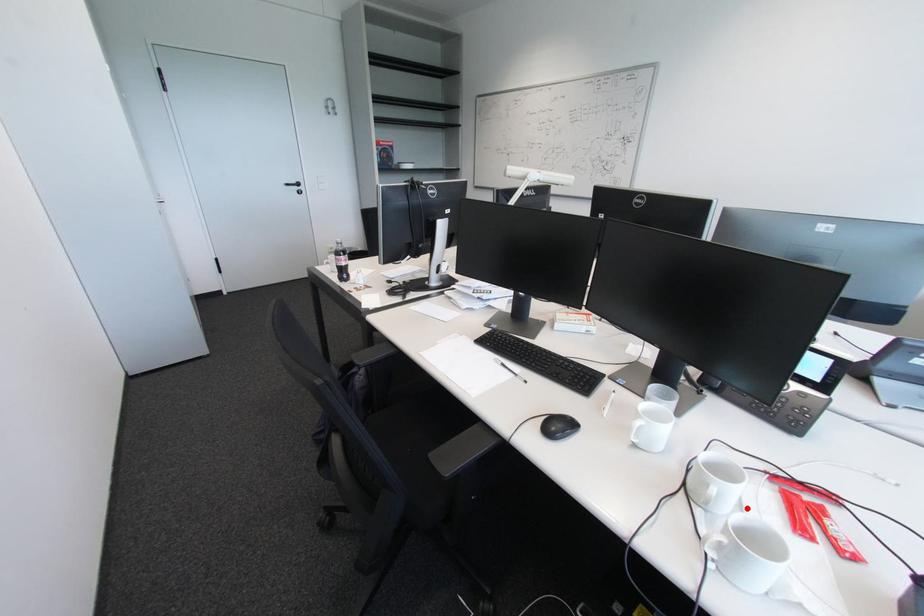
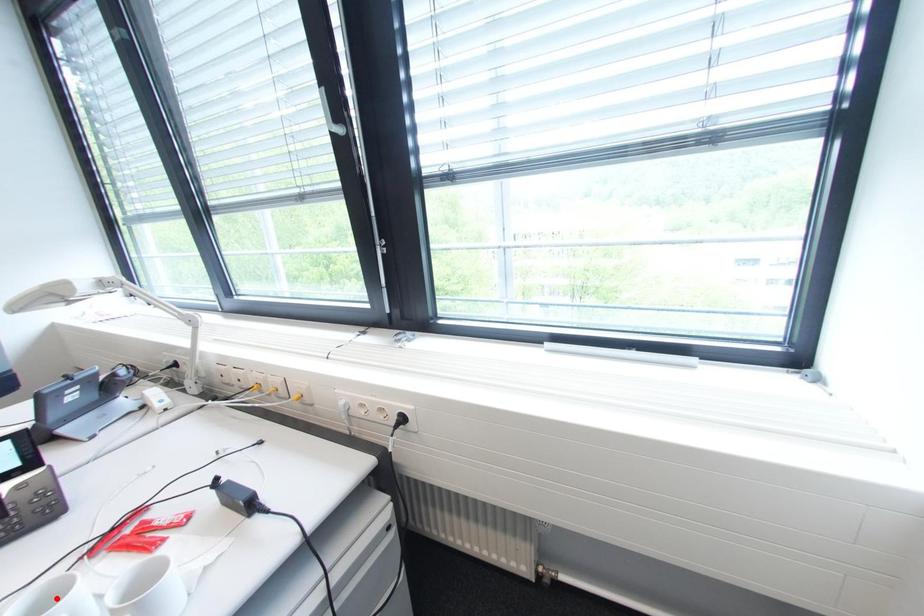
I am providing you with two images of the same scene from different viewpoints. A red point is marked on the first image and another point is marked on the second image. Is the red point in image1 aligned with the point shown in image2?

No